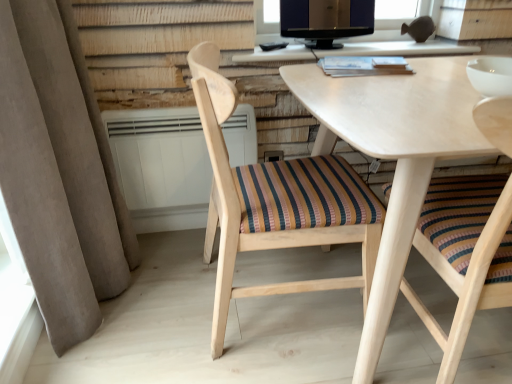
This screenshot has width=512, height=384. Identify the location of free point below matte black monitor at upper center (from a real-world perspective). (323, 46).